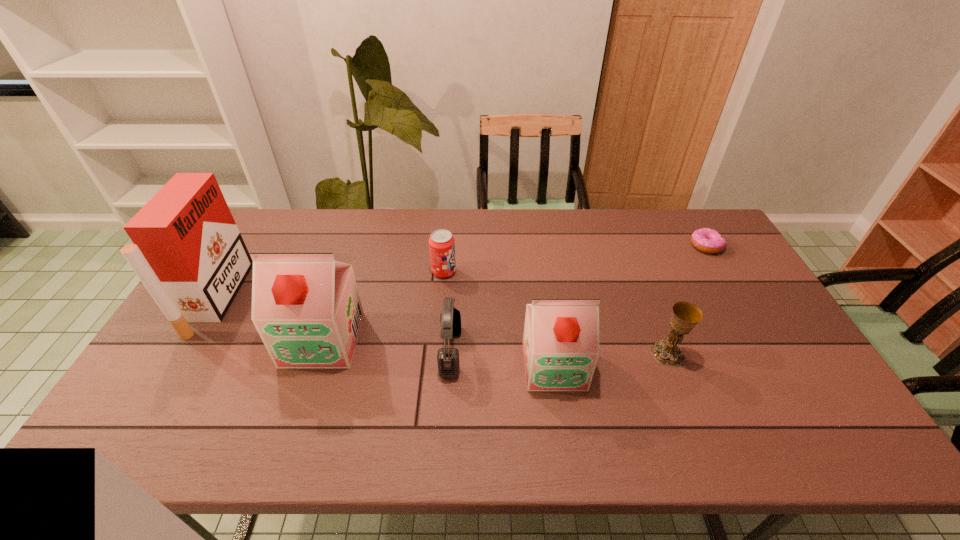
This screenshot has height=540, width=960. Identify the location of vacant space in between the farthest object and the left soya milk. (515, 293).

The height and width of the screenshot is (540, 960). Find the location of `blank region between the headset and the shortest object`. blank region between the headset and the shortest object is located at coordinates (578, 299).

Where is `free space between the second object from left to right and the chalice`? free space between the second object from left to right and the chalice is located at coordinates (495, 347).

At what (x,y) coordinates should I click in order to perform the action: click on vacant area that lies between the headset and the right soya milk. Please return your answer as a coordinate pair (x, y). The width and height of the screenshot is (960, 540). Looking at the image, I should click on (502, 359).

Identify the location of free space between the left soya milk and the second shortest object. (383, 306).

The width and height of the screenshot is (960, 540). Find the location of `object that stands as the closest to the taller soya milk`. object that stands as the closest to the taller soya milk is located at coordinates (188, 252).

Identify the location of object that is the third closest to the third tallest object. The height and width of the screenshot is (540, 960). (441, 242).

This screenshot has height=540, width=960. In order to click on free space that satisfies the following two spatial constraints: 1. on the headband of the chalice; 2. on the right side of the headset in this screenshot , I will do `click(450, 354)`.

The image size is (960, 540). What are the coordinates of `vacant space that satisfies the following two spatial constraints: 1. on the back side of the second object from right to left; 2. on the left side of the doughnut` in the screenshot? It's located at (626, 246).

You are a GUI agent. You are given a task and a screenshot of the screen. Output one action in this format:
    pyautogui.click(x=<x>, y=<y>)
    Task: Click on the vacant region that satisfies the following two spatial constraints: 1. on the back side of the rightmost object; 2. on the right side of the chalice
    
    Given the screenshot: What is the action you would take?
    pyautogui.click(x=626, y=246)